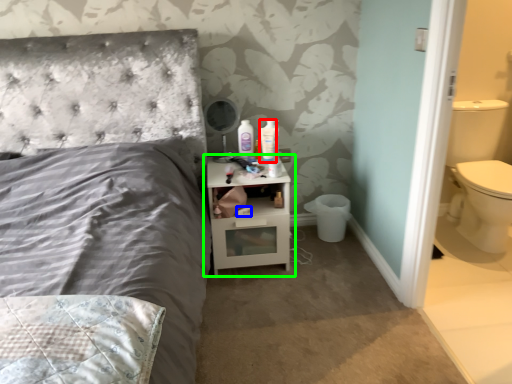
Question: Considering the real-world distances, which object is farthest from mouthwash (highlighted by a red box)? toilet paper (highlighted by a blue box) or nightstand (highlighted by a green box)?

Choices:
 (A) toilet paper
 (B) nightstand

Answer: (A)